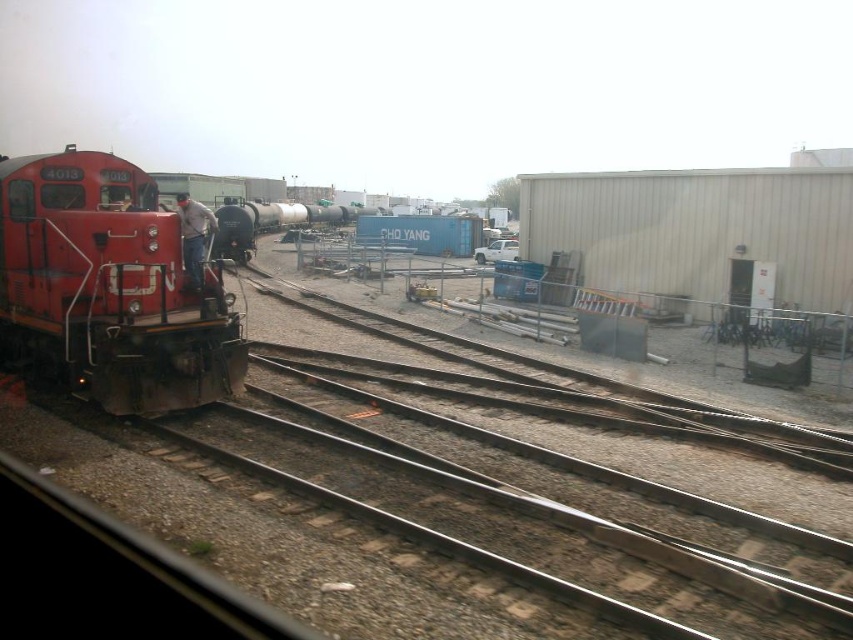
Does matte red train at left have a lesser width compared to clear glass window at left?

Incorrect, matte red train at left's width is not less than clear glass window at left's.

Can you confirm if matte red train at left is shorter than clear glass window at left?

No.

Is point (131, 172) closer to viewer compared to point (68, 208)?

No, it is not.

Locate an element on the screen. The height and width of the screenshot is (640, 853). matte red train at left is located at coordinates (109, 291).

Which is below, black glossy tank car at center or matte black train window at left?

matte black train window at left is lower down.

Does black glossy tank car at center have a lesser height compared to matte black train window at left?

No.

Describe the element at coordinates (268, 224) in the screenshot. I see `black glossy tank car at center` at that location.

The width and height of the screenshot is (853, 640). I want to click on black glossy tank car at center, so click(x=268, y=224).

From the picture: Is matte red train at left in front of black glossy tank car at center?

Yes.

Is point (84, 161) farther from viewer compared to point (339, 218)?

No, (84, 161) is in front of (339, 218).

Between point (187, 390) and point (303, 205), which one is positioned behind?

The point (303, 205) is more distant.

Image resolution: width=853 pixels, height=640 pixels. Find the location of `matte red train at left`. matte red train at left is located at coordinates (109, 291).